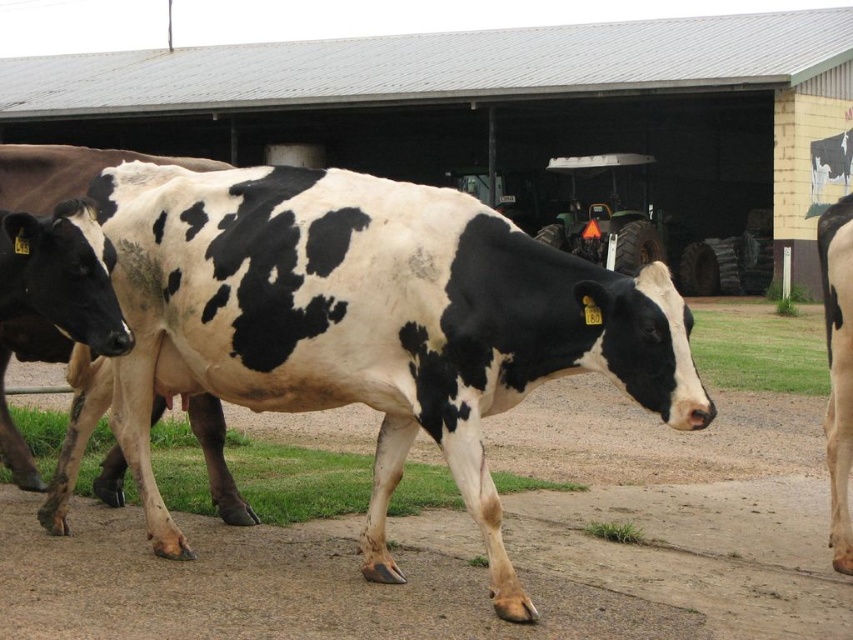
Question: Is black and white spotted cow at center further to camera compared to black and white cow at center?

Choices:
 (A) no
 (B) yes

Answer: (A)

Question: Observing the image, what is the correct spatial positioning of black and white spotted cow at center in reference to black and white cow at center?

Choices:
 (A) left
 (B) right

Answer: (B)

Question: Among these objects, which one is nearest to the camera?

Choices:
 (A) black and white cow at center
 (B) black and white spotted cow at center

Answer: (B)

Question: Can you confirm if black and white spotted cow at center is thinner than black and white cow at center?

Choices:
 (A) no
 (B) yes

Answer: (B)